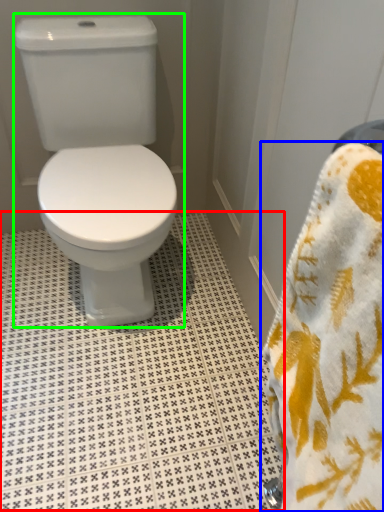
Question: Which object is the farthest from tile (highlighted by a red box)? Choose among these: towel (highlighted by a blue box) or toilet (highlighted by a green box).

Choices:
 (A) towel
 (B) toilet

Answer: (A)